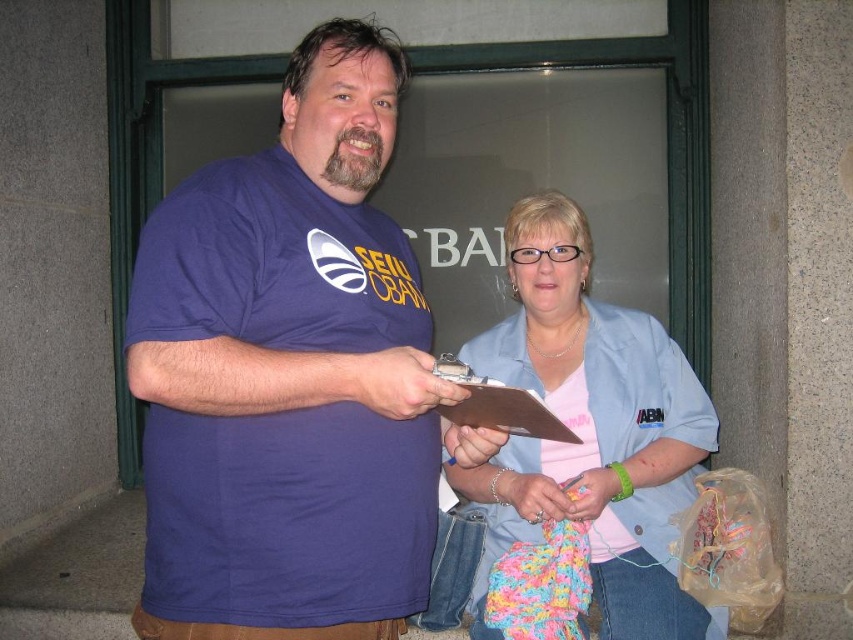
Is purple cotton t-shirt at center further to camera compared to light blue fabric at center?

No, it is in front of light blue fabric at center.

Which of these two, purple cotton t-shirt at center or light blue fabric at center, stands taller?

Standing taller between the two is purple cotton t-shirt at center.

What do you see at coordinates (291, 376) in the screenshot?
I see `purple cotton t-shirt at center` at bounding box center [291, 376].

Image resolution: width=853 pixels, height=640 pixels. Identify the location of purple cotton t-shirt at center. (291, 376).

Is light blue fabric at center shorter than brown cardboard clipboard at center?

No.

What do you see at coordinates (592, 428) in the screenshot?
I see `light blue fabric at center` at bounding box center [592, 428].

You are a GUI agent. You are given a task and a screenshot of the screen. Output one action in this format:
    pyautogui.click(x=<x>, y=<y>)
    Task: Click on the light blue fabric at center
    
    Given the screenshot: What is the action you would take?
    pyautogui.click(x=592, y=428)

Is purple cotton t-shirt at center positioned behind brown cardboard clipboard at center?

That is False.

Based on the photo, is purple cotton t-shirt at center taller than brown cardboard clipboard at center?

Yes.

Find the location of a particular element. The height and width of the screenshot is (640, 853). purple cotton t-shirt at center is located at coordinates (291, 376).

At what (x,y) coordinates should I click in order to perform the action: click on purple cotton t-shirt at center. Please return your answer as a coordinate pair (x, y). The image size is (853, 640). Looking at the image, I should click on (291, 376).